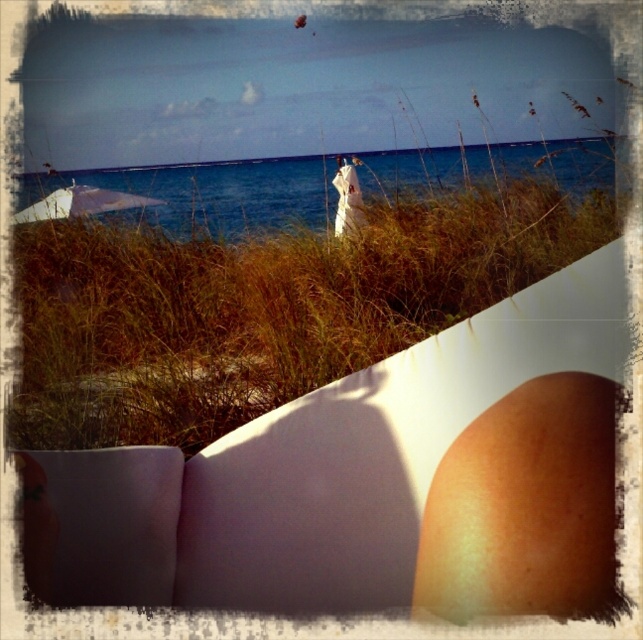
Question: Is brown grass at center thinner than blue water at center?

Choices:
 (A) yes
 (B) no

Answer: (B)

Question: Is brown grass at center smaller than blue water at center?

Choices:
 (A) no
 (B) yes

Answer: (A)

Question: Which point is closer to the camera taking this photo?

Choices:
 (A) (604, 145)
 (B) (21, 278)

Answer: (B)

Question: Among these points, which one is farthest from the camera?

Choices:
 (A) (509, 195)
 (B) (413, 154)

Answer: (B)

Question: Does brown grass at center have a lesser width compared to blue water at center?

Choices:
 (A) yes
 (B) no

Answer: (B)